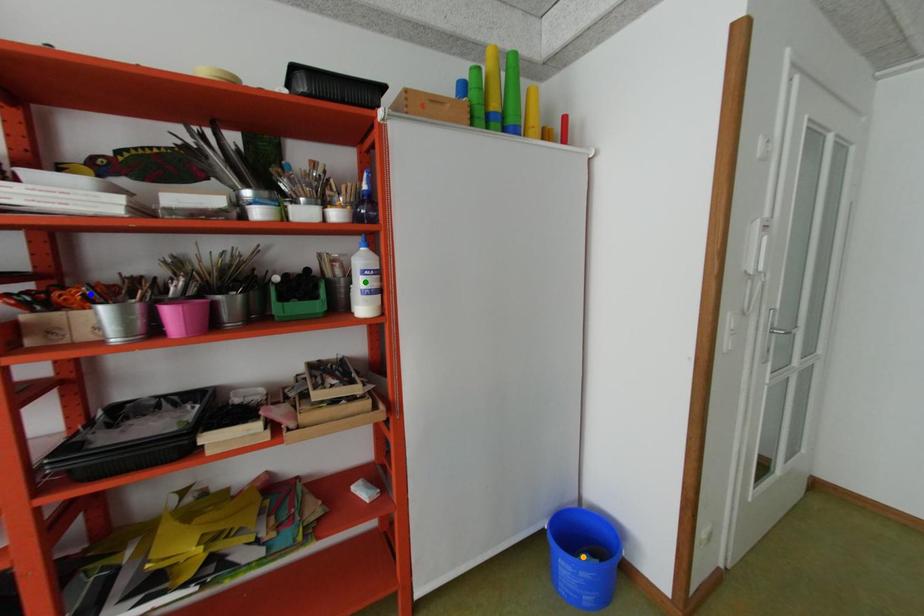
Order these from nearest to farthest:
orange point
blue point
green point

blue point, green point, orange point